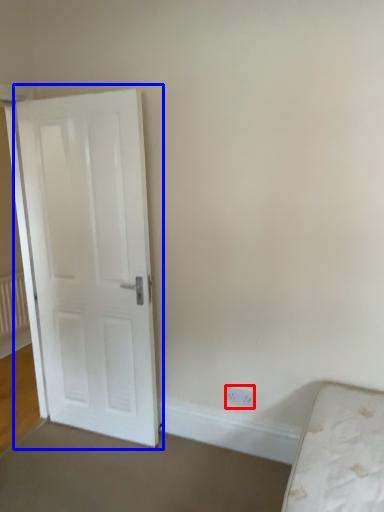
Question: Which object appears closest to the camera in this image, electric outlet (highlighted by a red box) or door (highlighted by a blue box)?

Choices:
 (A) electric outlet
 (B) door

Answer: (B)